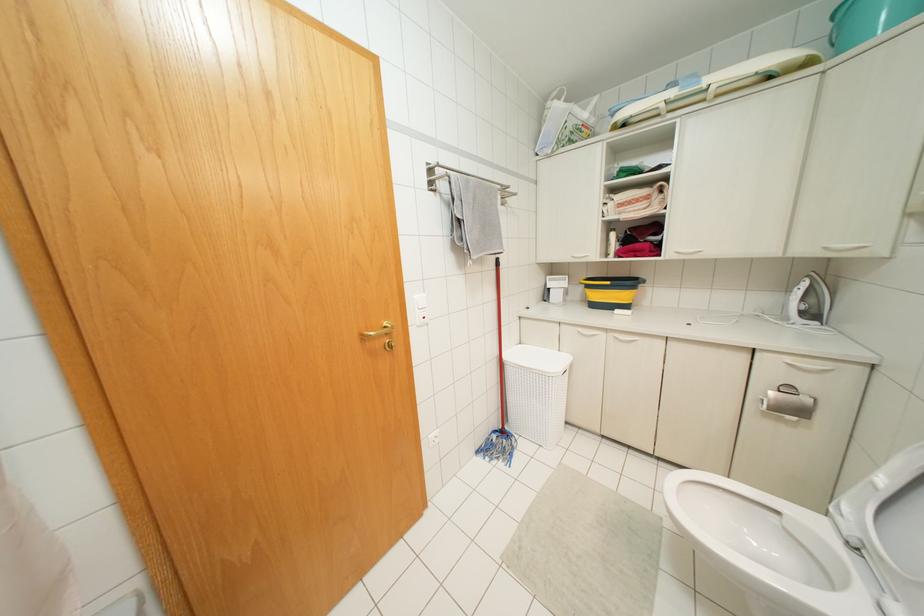
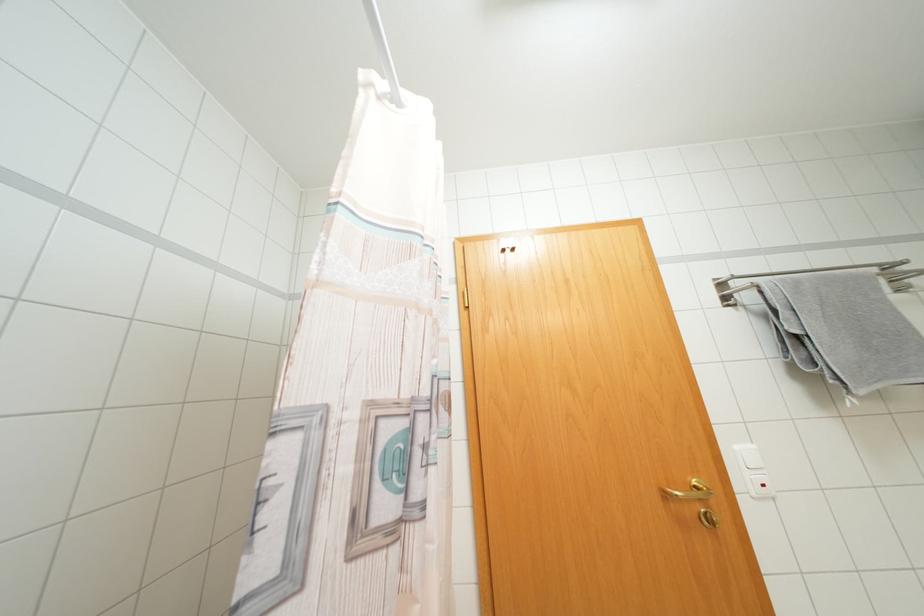
Find the pixel in the second image that matches [371,333] in the first image.

(676, 493)